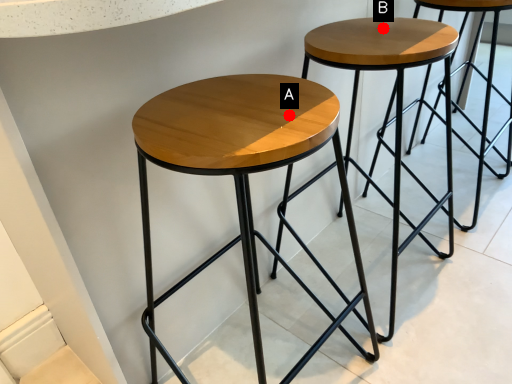
Question: Two points are circled on the image, labeled by A and B beside each circle. Which point is farther to the camera?

Choices:
 (A) A is further
 (B) B is further

Answer: (B)